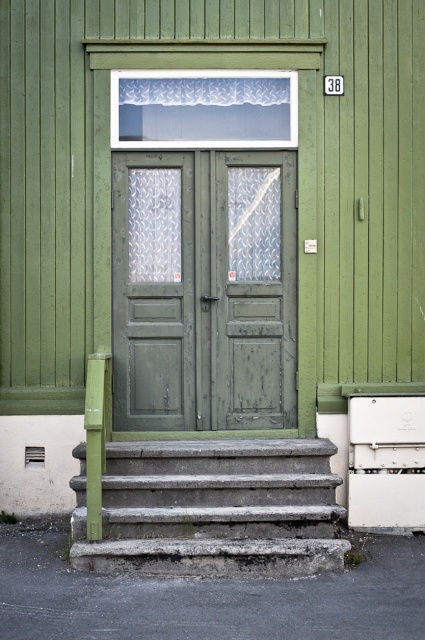
Question: Which point is closer to the camera?

Choices:
 (A) (254, 474)
 (B) (164, 406)

Answer: (A)

Question: Does green wooden door at center have a greater width compared to concrete steps at lower center?

Choices:
 (A) yes
 (B) no

Answer: (B)

Question: Is green wooden door at center closer to camera compared to concrete steps at lower center?

Choices:
 (A) no
 (B) yes

Answer: (A)

Question: Is green wooden door at center to the left of concrete steps at lower center from the viewer's perspective?

Choices:
 (A) no
 (B) yes

Answer: (B)